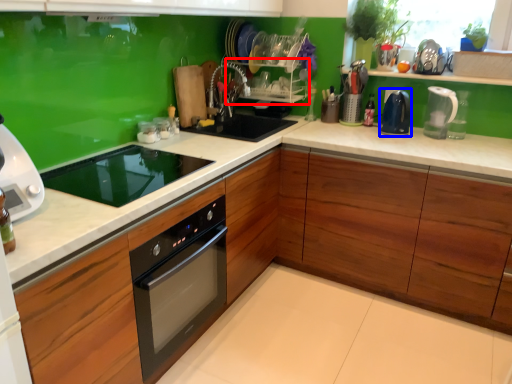
Question: Which point is closer to the camera, shelf (highlighted by a red box) or kitchen appliance (highlighted by a blue box)?

Choices:
 (A) shelf
 (B) kitchen appliance

Answer: (B)